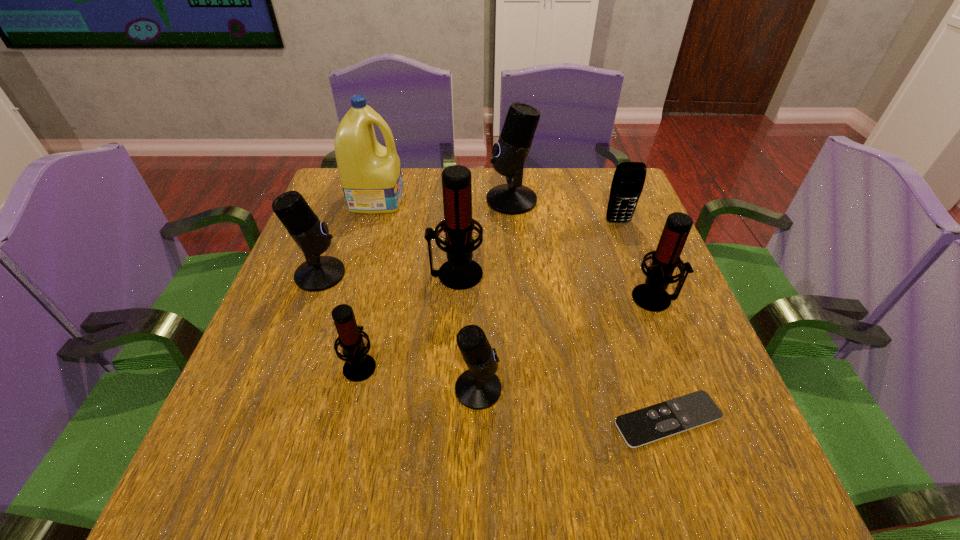
Locate an element on the screen. The width and height of the screenshot is (960, 540). the second microphone from left to right is located at coordinates (359, 366).

At what (x,y) coordinates should I click in order to perform the action: click on the nearest black microphone. Please return your answer as a coordinate pair (x, y). The width and height of the screenshot is (960, 540). Looking at the image, I should click on (478, 388).

The width and height of the screenshot is (960, 540). Identify the location of the shortest object. (674, 416).

What are the coordinates of `black remote control` in the screenshot? It's located at (674, 416).

Identify the location of vacant space located on the label of the detergent. (492, 199).

Locate an element on the screen. This screenshot has width=960, height=540. vacant area located on the stand of the biggest black microphone is located at coordinates (383, 200).

The width and height of the screenshot is (960, 540). Identify the location of free space located on the stand of the biggest black microphone. (362, 200).

Identify the location of vacant space located 0.270m on the stand of the biggest black microphone. The width and height of the screenshot is (960, 540). (390, 200).

In order to click on free space located on the front of the biggest red microphone in this screenshot , I will do `click(451, 352)`.

Identify the location of vacant region located on the stand of the leftmost black microphone. (427, 274).